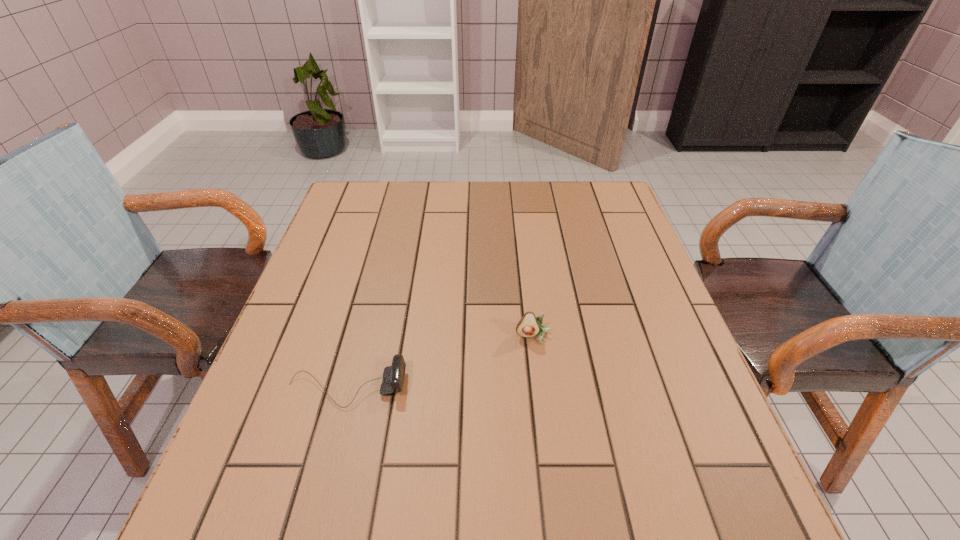
Locate an element on the screen. The height and width of the screenshot is (540, 960). avocado is located at coordinates (529, 326).

You are a GUI agent. You are given a task and a screenshot of the screen. Output one action in this format:
    pyautogui.click(x=<x>, y=<y>)
    Task: Click on the farther object
    The height and width of the screenshot is (540, 960).
    Given the screenshot: What is the action you would take?
    pyautogui.click(x=529, y=326)

I want to click on the shorter object, so click(393, 376).

The height and width of the screenshot is (540, 960). What are the coordinates of `the nearer object` in the screenshot? It's located at (393, 376).

At what (x,y) coordinates should I click in order to perform the action: click on vacant space located 0.100m on the seed side of the right object. Please return your answer as a coordinate pair (x, y). The height and width of the screenshot is (540, 960). Looking at the image, I should click on (539, 383).

Where is `vacant space situated on the front-facing side of the shorter object`? vacant space situated on the front-facing side of the shorter object is located at coordinates (561, 388).

Identify the location of object located at the left edge. (393, 376).

Where is `free space at the far edge`? The width and height of the screenshot is (960, 540). free space at the far edge is located at coordinates (403, 191).

The width and height of the screenshot is (960, 540). I want to click on free space at the near edge of the desktop, so click(502, 514).

I want to click on vacant region at the left edge of the desktop, so click(359, 233).